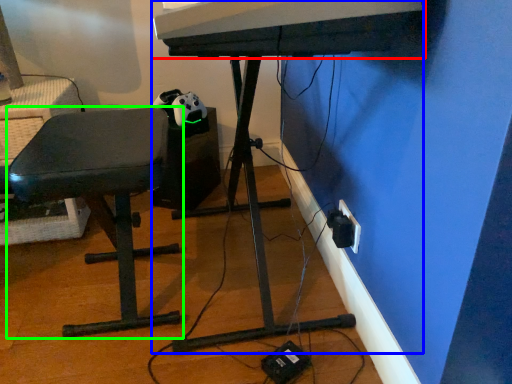
Question: Considering the real-world distances, which object is farthest from musical keyboard (highlighted by a red box)? computer desk (highlighted by a blue box) or furniture (highlighted by a green box)?

Choices:
 (A) computer desk
 (B) furniture

Answer: (A)